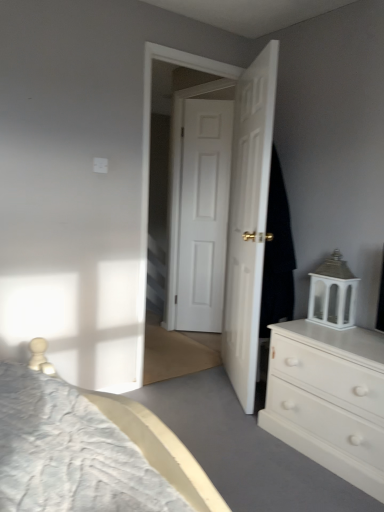
Question: Is white matte chest of drawers at right to the left of black fabric at right from the viewer's perspective?

Choices:
 (A) yes
 (B) no

Answer: (B)

Question: Is white matte chest of drawers at right shorter than black fabric at right?

Choices:
 (A) no
 (B) yes

Answer: (B)

Question: Is white matte chest of drawers at right further to camera compared to black fabric at right?

Choices:
 (A) no
 (B) yes

Answer: (A)

Question: Is white matte chest of drawers at right wider than black fabric at right?

Choices:
 (A) no
 (B) yes

Answer: (B)

Question: Is black fabric at right inside white matte chest of drawers at right?

Choices:
 (A) no
 (B) yes

Answer: (A)

Question: In the image, is black fabric at right on the left side or the right side of white glossy door at center, placed as the 2th door when sorted from back to front?

Choices:
 (A) left
 (B) right

Answer: (B)

Question: Relative to white glossy door at center, placed as the 2th door when sorted from back to front, is black fabric at right in front or behind?

Choices:
 (A) front
 (B) behind

Answer: (B)

Question: Considering the positions of black fabric at right and white glossy door at center, positioned as the first door in front-to-back order, in the image, is black fabric at right wider or thinner than white glossy door at center, positioned as the first door in front-to-back order,?

Choices:
 (A) thin
 (B) wide

Answer: (B)

Question: Based on their sizes in the image, would you say black fabric at right is bigger or smaller than white glossy door at center, placed as the 2th door when sorted from back to front?

Choices:
 (A) big
 (B) small

Answer: (B)

Question: Is white matte chest of drawers at right wider or thinner than white wooden door at center?

Choices:
 (A) thin
 (B) wide

Answer: (B)

Question: Is white matte chest of drawers at right inside or outside of white wooden door at center?

Choices:
 (A) inside
 (B) outside

Answer: (B)

Question: From the image's perspective, is white matte chest of drawers at right above or below white wooden door at center?

Choices:
 (A) above
 (B) below

Answer: (B)

Question: Is point (329, 346) positioned closer to the camera than point (253, 117)?

Choices:
 (A) closer
 (B) farther

Answer: (A)

Question: From the image's perspective, relative to black fabric at right, is white matte door at center, marked as the 2th door in a front-to-back arrangement, above or below?

Choices:
 (A) above
 (B) below

Answer: (A)

Question: In terms of size, does white matte door at center, placed as the 1th door when sorted from back to front, appear bigger or smaller than black fabric at right?

Choices:
 (A) small
 (B) big

Answer: (A)